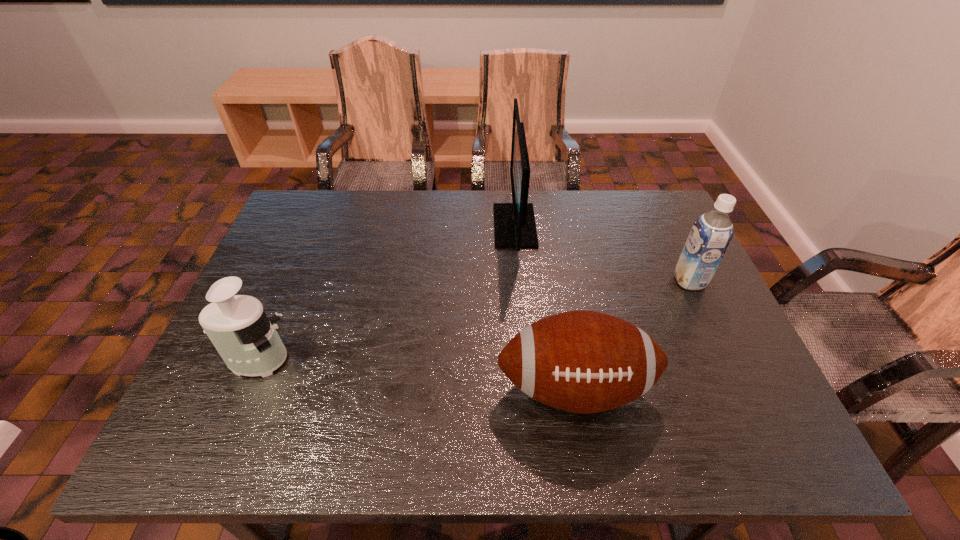
In the image, there is a desktop. Where is `free region at the right edge`? free region at the right edge is located at coordinates (697, 326).

At what (x,y) coordinates should I click in order to perform the action: click on blank space at the far left corner of the desktop. Please return your answer as a coordinate pair (x, y). Looking at the image, I should click on (310, 235).

Locate an element on the screen. This screenshot has width=960, height=540. free spot at the near left corner of the desktop is located at coordinates (252, 447).

Image resolution: width=960 pixels, height=540 pixels. What are the coordinates of `free space at the far right corner` in the screenshot? It's located at (649, 198).

I want to click on vacant space at the near right corner of the desktop, so click(x=716, y=438).

The height and width of the screenshot is (540, 960). Identify the location of empty space between the football and the leftmost object. (416, 374).

The width and height of the screenshot is (960, 540). What are the coordinates of `empty space that is in between the rightmost object and the tallest object` in the screenshot? It's located at (602, 253).

Find the location of `free space between the leftmost object and the third nearest object`. free space between the leftmost object and the third nearest object is located at coordinates (473, 320).

You are a GUI agent. You are given a task and a screenshot of the screen. Output one action in this format:
    pyautogui.click(x=<x>, y=<y>)
    Task: Click on the vacant area that lies between the tallest object and the shortest object
    
    Given the screenshot: What is the action you would take?
    pyautogui.click(x=545, y=307)

Locate an element on the screen. This screenshot has width=960, height=540. vacant point located between the third nearest object and the juicer is located at coordinates [473, 320].